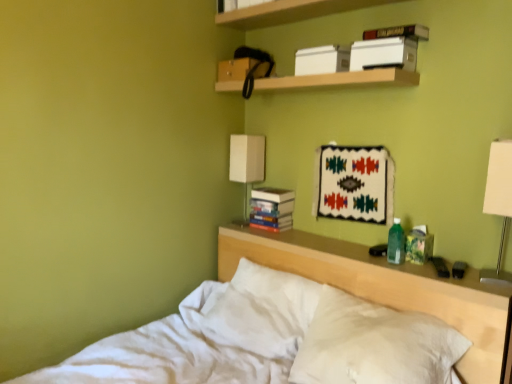
The height and width of the screenshot is (384, 512). Identify the location of free spot below hardcover books at center, the first paperback book viewed from the left (from a real-world perspective). (269, 228).